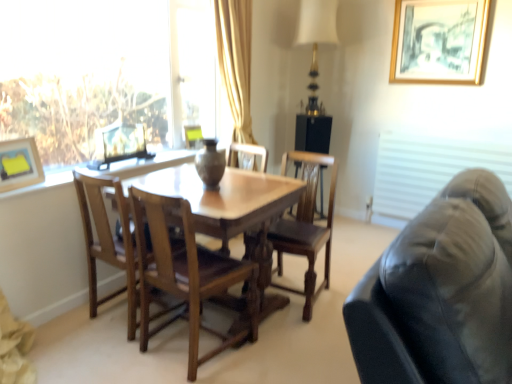
What do you see at coordinates (440, 293) in the screenshot? I see `leather couch at right` at bounding box center [440, 293].

The width and height of the screenshot is (512, 384). I want to click on wooden chair at center, placed as the third chair when sorted from left to right, so click(x=305, y=225).

Image resolution: width=512 pixels, height=384 pixels. Find the location of `light brown wood chair at center, which is the 3th chair in right-to-left order`. light brown wood chair at center, which is the 3th chair in right-to-left order is located at coordinates (108, 241).

Where is `white fabric blind at right`? white fabric blind at right is located at coordinates (431, 167).

Measure the distance between point (13,151) and camera.

They are 2.18 meters apart.

I want to click on wooden chair at center, which appears as the 2th chair when viewed from the right, so click(185, 272).

Identify the location of leather couch at right. (440, 293).

Does matte yellow picture frame at center, the 2th picture frame from the right, have a greater height compared to gold metallic table lamp at upper center?

No, matte yellow picture frame at center, the 2th picture frame from the right, is not taller than gold metallic table lamp at upper center.

Which object is closer to the camera taking this photo, matte yellow picture frame at center, the 3th picture frame in the front-to-back sequence, or gold metallic table lamp at upper center?

Positioned in front is matte yellow picture frame at center, the 3th picture frame in the front-to-back sequence.

Is matte yellow picture frame at center, arranged as the second picture frame when viewed from the top, facing away from gold metallic table lamp at upper center?

matte yellow picture frame at center, arranged as the second picture frame when viewed from the top, does not have its back to gold metallic table lamp at upper center.

From a real-world perspective, is matte yellow picture frame at center, the 2th picture frame from the right, below gold metallic table lamp at upper center?

Yes, from a real-world perspective, matte yellow picture frame at center, the 2th picture frame from the right, is beneath gold metallic table lamp at upper center.

Considering the points (327, 220) and (432, 189), which point is behind, point (327, 220) or point (432, 189)?

The point (432, 189) is behind.

Which is in front, wooden chair at center, placed as the third chair when sorted from left to right, or white fabric blind at right?

wooden chair at center, placed as the third chair when sorted from left to right, is closer to the camera.

From a real-world perspective, who is located lower, wooden chair at center, the first chair positioned from the right, or white fabric blind at right?

wooden chair at center, the first chair positioned from the right, from a real-world perspective.

Where is `the 1st chair to the left of the white fabric blind at right, starting your count from the anchor`? The image size is (512, 384). the 1st chair to the left of the white fabric blind at right, starting your count from the anchor is located at coordinates (305, 225).

Is matte yellow picture frame at upper left, which ranks as the first picture frame in left-to-right order, not close to wooden chair at center, the 2th chair when ordered from left to right?

Actually, matte yellow picture frame at upper left, which ranks as the first picture frame in left-to-right order, and wooden chair at center, the 2th chair when ordered from left to right, are a little close together.

How far apart are matte yellow picture frame at upper left, acting as the third picture frame starting from the right, and wooden chair at center, which appears as the 2th chair when viewed from the right?

A distance of 90.63 centimeters exists between matte yellow picture frame at upper left, acting as the third picture frame starting from the right, and wooden chair at center, which appears as the 2th chair when viewed from the right.

Is the position of matte yellow picture frame at upper left, which ranks as the first picture frame in left-to-right order, less distant than that of wooden chair at center, the 2th chair when ordered from left to right?

No, matte yellow picture frame at upper left, which ranks as the first picture frame in left-to-right order, is further to the viewer.

Considering the sizes of objects matte yellow picture frame at upper left, which is counted as the third picture frame, starting from the top, and wooden chair at center, which appears as the 2th chair when viewed from the right, in the image provided, who is shorter, matte yellow picture frame at upper left, which is counted as the third picture frame, starting from the top, or wooden chair at center, which appears as the 2th chair when viewed from the right,?

matte yellow picture frame at upper left, which is counted as the third picture frame, starting from the top.

Is the position of light brown wood chair at center, acting as the 1th chair starting from the left, less distant than that of matte brown vase at center?

Yes, it is.

Identify the location of the 2nd chair to the left when counting from the matte brown vase at center. Image resolution: width=512 pixels, height=384 pixels. (108, 241).

Considering the sizes of objects light brown wood chair at center, acting as the 1th chair starting from the left, and matte brown vase at center in the image provided, who is thinner, light brown wood chair at center, acting as the 1th chair starting from the left, or matte brown vase at center?

matte brown vase at center.

In terms of size, does light brown wood chair at center, which is the 3th chair in right-to-left order, appear bigger or smaller than matte brown vase at center?

Clearly, light brown wood chair at center, which is the 3th chair in right-to-left order, is larger in size than matte brown vase at center.

From the image's perspective, is wooden chair at center, which appears as the 2th chair when viewed from the right, positioned above or below gold metallic table lamp at upper center?

Based on their image positions, wooden chair at center, which appears as the 2th chair when viewed from the right, is located beneath gold metallic table lamp at upper center.

Locate an element on the screen. chair that is the 1st one below the gold metallic table lamp at upper center (from a real-world perspective) is located at coordinates (185, 272).

Could you measure the distance between wooden chair at center, the 2th chair when ordered from left to right, and gold metallic table lamp at upper center?

wooden chair at center, the 2th chair when ordered from left to right, is 2.43 meters away from gold metallic table lamp at upper center.

Can you confirm if wooden chair at center, which appears as the 2th chair when viewed from the right, is bigger than gold metallic table lamp at upper center?

Correct, wooden chair at center, which appears as the 2th chair when viewed from the right, is larger in size than gold metallic table lamp at upper center.

Is transparent glass window at upper left bigger than wooden chair at center, the 2th chair when ordered from left to right?

Yes, transparent glass window at upper left is bigger than wooden chair at center, the 2th chair when ordered from left to right.

Considering the relative positions of transparent glass window at upper left and wooden chair at center, which appears as the 2th chair when viewed from the right, in the image provided, is transparent glass window at upper left to the left of wooden chair at center, which appears as the 2th chair when viewed from the right, from the viewer's perspective?

Yes.

Which object is thinner, transparent glass window at upper left or wooden chair at center, which appears as the 2th chair when viewed from the right?

Thinner between the two is transparent glass window at upper left.

From the image's perspective, between transparent glass window at upper left and wooden chair at center, which appears as the 2th chair when viewed from the right, who is located below?

wooden chair at center, which appears as the 2th chair when viewed from the right, is shown below in the image.

Does wooden chair at center, the 2th chair when ordered from left to right, turn towards light brown wood chair at center, acting as the 1th chair starting from the left?

No, wooden chair at center, the 2th chair when ordered from left to right, is not facing towards light brown wood chair at center, acting as the 1th chair starting from the left.

Based on their positions, is wooden chair at center, the 2th chair when ordered from left to right, located to the left or right of light brown wood chair at center, acting as the 1th chair starting from the left?

Clearly, wooden chair at center, the 2th chair when ordered from left to right, is on the right of light brown wood chair at center, acting as the 1th chair starting from the left, in the image.

How different are the orientations of wooden chair at center, the 2th chair when ordered from left to right, and light brown wood chair at center, which is the 3th chair in right-to-left order, in degrees?

0.513 degrees separate the facing orientations of wooden chair at center, the 2th chair when ordered from left to right, and light brown wood chair at center, which is the 3th chair in right-to-left order.

Considering the relative sizes of wooden chair at center, which appears as the 2th chair when viewed from the right, and light brown wood chair at center, acting as the 1th chair starting from the left, in the image provided, is wooden chair at center, which appears as the 2th chair when viewed from the right, wider than light brown wood chair at center, acting as the 1th chair starting from the left,?

Yes, wooden chair at center, which appears as the 2th chair when viewed from the right, is wider than light brown wood chair at center, acting as the 1th chair starting from the left.

You are a GUI agent. You are given a task and a screenshot of the screen. Output one action in this format:
    pyautogui.click(x=<x>, y=<y>)
    Task: Click on the picture frame that is the 1st object to the left of the gold metallic table lamp at upper center, starting at the anchor
    
    Given the screenshot: What is the action you would take?
    pyautogui.click(x=192, y=135)

From the white fabric blind at right, count 1st chairs forward and point to it. Please provide its 2D coordinates.

[(305, 225)]

Consider the image. When comparing their distances from matte yellow picture frame at center, arranged as the second picture frame when viewed from the top, does gold metallic table lamp at upper center or wooden chair at center, which appears as the 2th chair when viewed from the right, seem closer?

Among the two, gold metallic table lamp at upper center is located nearer to matte yellow picture frame at center, arranged as the second picture frame when viewed from the top.

Which object lies further to the anchor point light brown wood chair at center, which is the 3th chair in right-to-left order, wooden chair at center, the 2th chair when ordered from left to right, or leather couch at right?

leather couch at right is further to light brown wood chair at center, which is the 3th chair in right-to-left order.

From the image, which object appears to be nearer to gold metallic table lamp at upper center, transparent glass window at upper left or wooden chair at center, the first chair positioned from the right?

The object closer to gold metallic table lamp at upper center is wooden chair at center, the first chair positioned from the right.

From the image, which object appears to be nearer to white fabric blind at right, gold-framed print at upper right, arranged as the third picture frame when ordered from the bottom, or wooden chair at center, the 2th chair when ordered from left to right?

Among the two, gold-framed print at upper right, arranged as the third picture frame when ordered from the bottom, is located nearer to white fabric blind at right.

When comparing their distances from matte yellow picture frame at upper left, the first picture frame in the front-to-back sequence, does transparent glass window at upper left or gold-framed print at upper right, the first picture frame viewed from the top, seem closer?

The object closer to matte yellow picture frame at upper left, the first picture frame in the front-to-back sequence, is transparent glass window at upper left.

Which object lies nearer to the anchor point wooden table at center, matte yellow picture frame at center, arranged as the second picture frame when viewed from the top, or leather couch at right?

leather couch at right.

Estimate the real-world distances between objects in this image. Which object is closer to wooden chair at center, the 2th chair when ordered from left to right, gold metallic table lamp at upper center or matte brown vase at center?

Among the two, matte brown vase at center is located nearer to wooden chair at center, the 2th chair when ordered from left to right.

When comparing their distances from matte brown vase at center, does transparent glass window at upper left or wooden table at center seem further?

The object further to matte brown vase at center is transparent glass window at upper left.

At what (x,y) coordinates should I click in order to perform the action: click on kitchen & dining room table between matte brown vase at center and wooden chair at center, the 2th chair when ordered from left to right, in the vertical direction. Please return your answer as a coordinate pair (x, y). Looking at the image, I should click on (234, 213).

This screenshot has width=512, height=384. Identify the location of picture frame between matte yellow picture frame at upper left, the first picture frame in the front-to-back sequence, and wooden chair at center, the first chair positioned from the right, from left to right. (192, 135).

The height and width of the screenshot is (384, 512). Identify the location of kitchen & dining room table situated between matte yellow picture frame at center, placed as the second picture frame when sorted from bottom to top, and gold-framed print at upper right, the first picture frame from the right, from left to right. (234, 213).

Locate an element on the screen. This screenshot has width=512, height=384. blind positioned between leather couch at right and gold metallic table lamp at upper center from near to far is located at coordinates (431, 167).